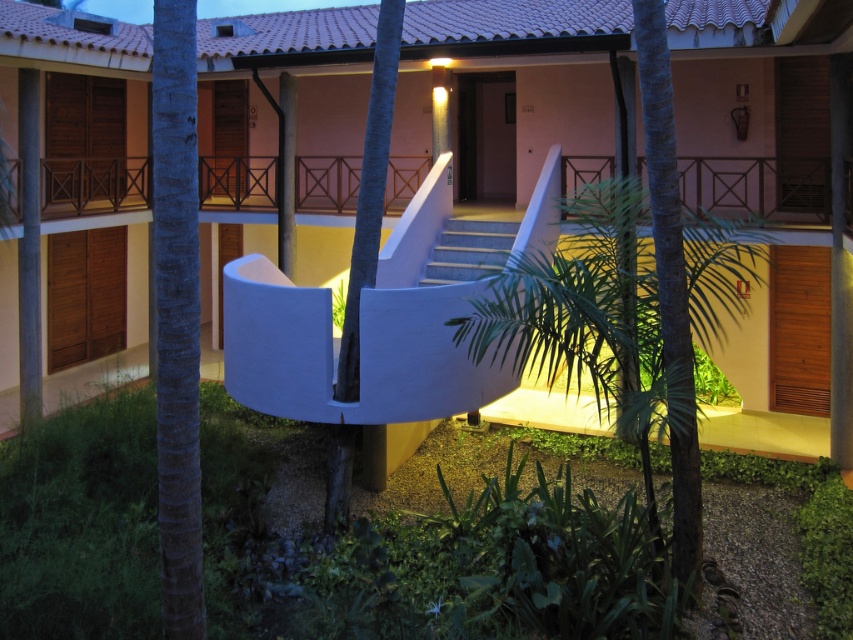
You are standing at the base of the curved white staircase leading up to the entrance of the building. You see two points marked in the scene. Which point is closer to you, point (x=143, y=259) or point (x=189, y=440)?

Point (x=143, y=259) is closer to you because it is further to the viewer than point (x=189, y=440).

You are standing at the base of the curved white staircase leading up to the building entrance. You want to walk directly towards the green leafy palm tree at center. Is there enough space to walk straight ahead without obstacles?

The green leafy palm tree at center is 19.78 feet away from you, so yes, there is enough space to walk straight ahead without obstacles since the distance is sufficient and there are no mentioned obstacles in the path between you and the palm tree.